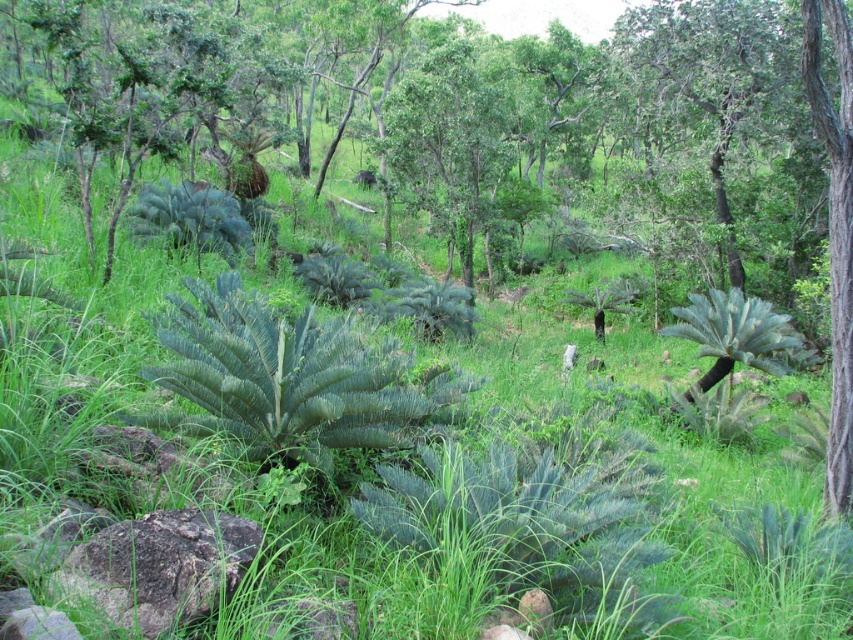
You are standing in the forest and want to move from point A to point B. Point A is at coordinates point (273, 449) and point B is at coordinates point (213, 520). Which point is closer to you when you are at point A?

Point A is at coordinates point (273, 449) and point B is at coordinates point (213, 520). Since point A is the starting point, it is naturally closer to you than point B.

You are a hiker trying to find your way through the forest. You see the green fibrous fern at center and the gray rough rock at lower left. Which object is located to the left of the other?

The green fibrous fern at center is positioned on the left side of gray rough rock at lower left.

You are a hiker who wants to place a 3.5 feet long hiking pole between the green fibrous fern at center and the gray rough rock at lower left. Can the pole fit horizontally between them without bending?

The distance between the green fibrous fern at center and the gray rough rock at lower left is 4.23 feet, which is longer than the 3.5 feet length of the hiking pole. Therefore, the pole can fit horizontally between them without bending.